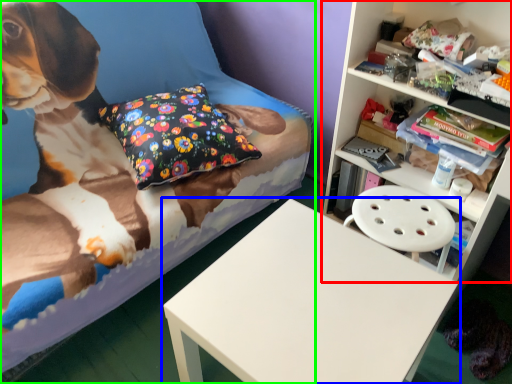
Question: Which object is the farthest from shelf (highlighted by a red box)? Choose among these: table (highlighted by a blue box) or bed (highlighted by a green box).

Choices:
 (A) table
 (B) bed

Answer: (B)